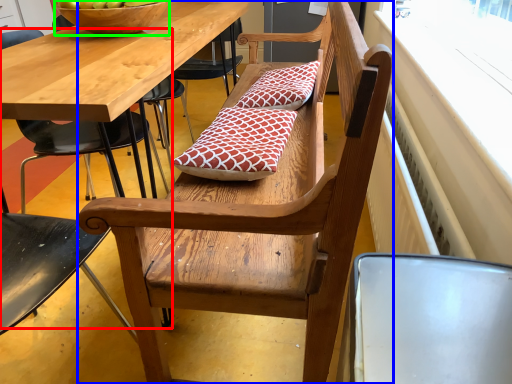
Question: Which is farther away from chair (highlighted by a red box)? bench (highlighted by a blue box) or bowl (highlighted by a green box)?

Choices:
 (A) bench
 (B) bowl

Answer: (A)